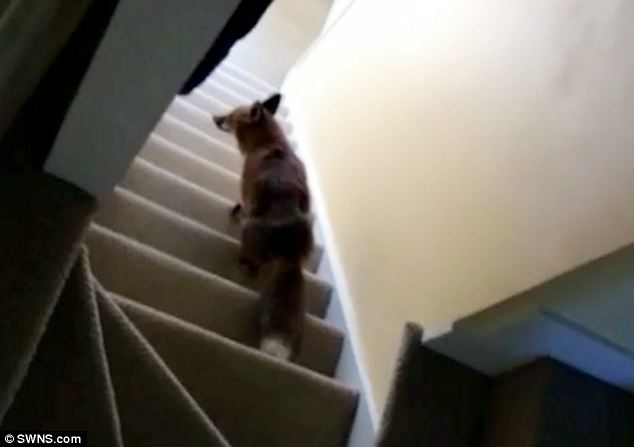
The image size is (634, 447). Find the location of `wall`. wall is located at coordinates (529, 137).